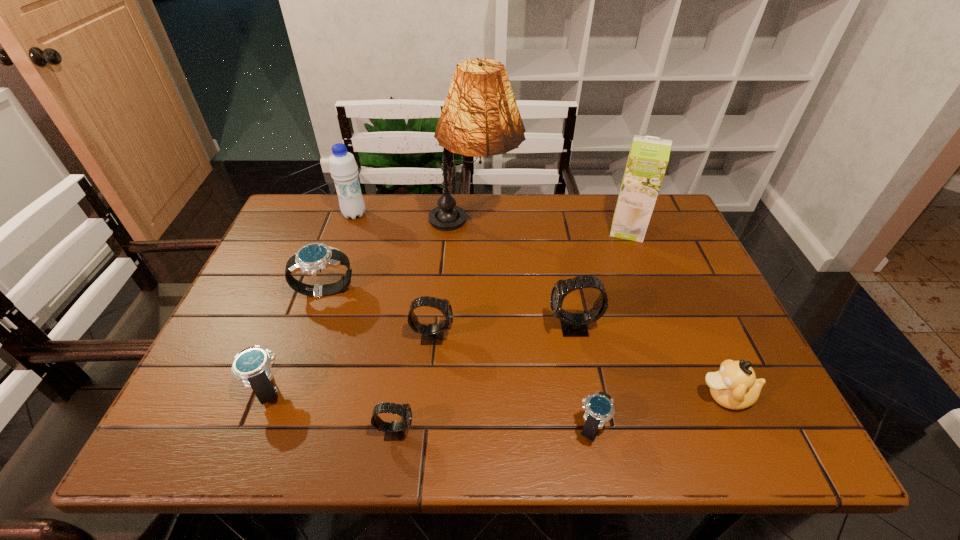
You are a GUI agent. You are given a task and a screenshot of the screen. Output one action in this format:
    pyautogui.click(x=<x>, y=<y>)
    Task: Click on the free space located on the face of the biggest gray watch
    This screenshot has width=960, height=540.
    Given the screenshot: What is the action you would take?
    pyautogui.click(x=414, y=328)

At what (x,y) coordinates should I click in order to perform the action: click on vacant space located on the right of the biggest silver watch. Please return your answer as a coordinate pair (x, y). This screenshot has height=540, width=960. Looking at the image, I should click on (494, 292).

Where is `free space located 0.070m on the face of the second smallest gray watch`? This screenshot has width=960, height=540. free space located 0.070m on the face of the second smallest gray watch is located at coordinates (485, 336).

Locate an element on the screen. vacant space located on the face of the duckling is located at coordinates (604, 396).

The height and width of the screenshot is (540, 960). I want to click on free location located on the face of the duckling, so click(579, 396).

Find the location of a particular element. vacant area situated 0.380m on the face of the duckling is located at coordinates (510, 396).

You are a GUI agent. You are given a task and a screenshot of the screen. Output one action in this format:
    pyautogui.click(x=<x>, y=<y>)
    Task: Click on the vacant space situated on the back of the second biggest silver watch
    
    Given the screenshot: What is the action you would take?
    pyautogui.click(x=295, y=320)

Locate an element on the screen. This screenshot has width=960, height=540. free space located 0.130m on the face of the smallest gray watch is located at coordinates (482, 431).

Locate an element on the screen. The image size is (960, 540). free space located on the back of the shortest watch is located at coordinates (563, 272).

Locate an element on the screen. This screenshot has height=540, width=960. lampshade at the far edge is located at coordinates click(x=480, y=117).